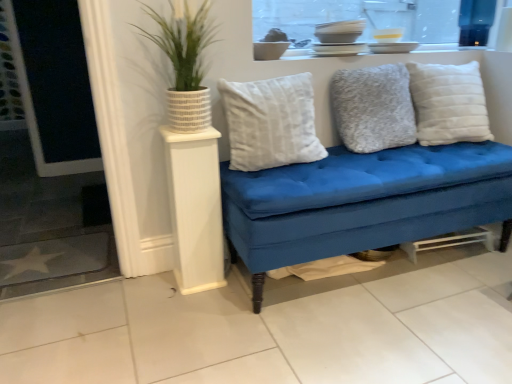
Question: Can you confirm if white textured pillow at right, which is the third pillow in left-to-right order, is positioned to the left of white wood side table at left?

Choices:
 (A) no
 (B) yes

Answer: (A)

Question: Is white textured pillow at right, the 1th pillow in the right-to-left sequence, at the right side of white wood side table at left?

Choices:
 (A) yes
 (B) no

Answer: (A)

Question: Is white textured pillow at right, which is the third pillow in left-to-right order, turned away from white wood side table at left?

Choices:
 (A) yes
 (B) no

Answer: (B)

Question: Is white textured pillow at right, the 1th pillow in the right-to-left sequence, wider than white wood side table at left?

Choices:
 (A) yes
 (B) no

Answer: (A)

Question: Considering the relative sizes of white textured pillow at right, which is the third pillow in left-to-right order, and white wood side table at left in the image provided, is white textured pillow at right, which is the third pillow in left-to-right order, smaller than white wood side table at left?

Choices:
 (A) no
 (B) yes

Answer: (A)

Question: From the image's perspective, is green textured plant at upper left positioned above or below white textured pillow at right, which is the third pillow in left-to-right order?

Choices:
 (A) below
 (B) above

Answer: (B)

Question: Is green textured plant at upper left spatially inside white textured pillow at right, which is the third pillow in left-to-right order, or outside of it?

Choices:
 (A) inside
 (B) outside

Answer: (B)

Question: Is green textured plant at upper left to the left or to the right of white textured pillow at right, the 1th pillow in the right-to-left sequence, in the image?

Choices:
 (A) right
 (B) left

Answer: (B)

Question: Considering the positions of green textured plant at upper left and white textured pillow at right, which is the third pillow in left-to-right order, in the image, is green textured plant at upper left wider or thinner than white textured pillow at right, which is the third pillow in left-to-right order,?

Choices:
 (A) wide
 (B) thin

Answer: (B)

Question: Is fuzzy gray pillow at center, marked as the second pillow in a left-to-right arrangement, situated inside white plush pillow at center, placed as the 3th pillow when sorted from right to left, or outside?

Choices:
 (A) outside
 (B) inside

Answer: (A)

Question: From a real-world perspective, is fuzzy gray pillow at center, which is the second pillow from right to left, physically located above or below white plush pillow at center, the first pillow in the left-to-right sequence?

Choices:
 (A) above
 (B) below

Answer: (A)

Question: In the image, is fuzzy gray pillow at center, marked as the second pillow in a left-to-right arrangement, positioned in front of or behind white plush pillow at center, placed as the 3th pillow when sorted from right to left?

Choices:
 (A) behind
 (B) front

Answer: (A)

Question: Is point (358, 148) positioned closer to the camera than point (298, 135)?

Choices:
 (A) closer
 (B) farther

Answer: (B)

Question: In terms of width, does fuzzy gray pillow at center, marked as the second pillow in a left-to-right arrangement, look wider or thinner when compared to white wood side table at left?

Choices:
 (A) wide
 (B) thin

Answer: (B)

Question: Based on their positions, is fuzzy gray pillow at center, which is the second pillow from right to left, located to the left or right of white wood side table at left?

Choices:
 (A) right
 (B) left

Answer: (A)